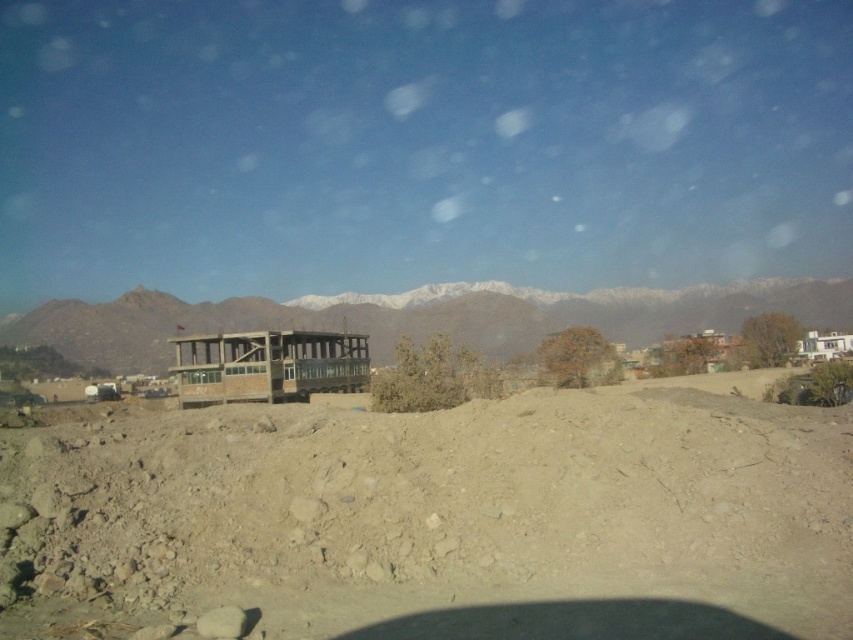
Question: Which point is farther to the camera?

Choices:
 (A) brown sandy dirt field at center
 (B) brown wooden gazebo at center
 (C) snowy rocky mountain at center

Answer: (C)

Question: Which of the following is the farthest from the observer?

Choices:
 (A) brown sandy dirt field at center
 (B) snowy rocky mountain at center
 (C) brown wooden gazebo at center

Answer: (B)

Question: In this image, where is snowy rocky mountain at center located relative to brown wooden gazebo at center?

Choices:
 (A) above
 (B) below

Answer: (A)

Question: Does snowy rocky mountain at center appear on the right side of brown wooden gazebo at center?

Choices:
 (A) yes
 (B) no

Answer: (A)

Question: Which is farther from the brown wooden gazebo at center?

Choices:
 (A) snowy rocky mountain at center
 (B) brown sandy dirt field at center

Answer: (B)

Question: Can you confirm if brown sandy dirt field at center is smaller than brown wooden gazebo at center?

Choices:
 (A) no
 (B) yes

Answer: (B)